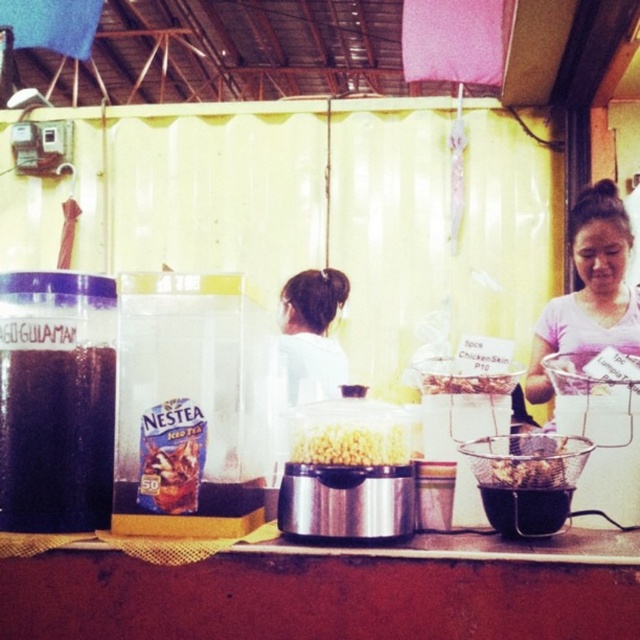
Can you confirm if yellow matte popcorn at center is shorter than brown crispy chicken skin at center?

Incorrect, yellow matte popcorn at center's height does not fall short of brown crispy chicken skin at center's.

Does point (385, 444) come in front of point (518, 458)?

No, it is behind (518, 458).

Locate an element on the screen. yellow matte popcorn at center is located at coordinates (353, 442).

Locate an element on the screen. white fabric hair at center is located at coordinates (312, 332).

Is white fabric hair at center bigger than brown crispy chicken skin at center?

Yes, white fabric hair at center is bigger than brown crispy chicken skin at center.

The height and width of the screenshot is (640, 640). Find the location of `white fabric hair at center`. white fabric hair at center is located at coordinates (312, 332).

Which is behind, point (570, 300) or point (472, 381)?

Positioned behind is point (570, 300).

From the picture: Who is more forward, (588,284) or (476,385)?

Positioned in front is point (476,385).

You are a GUI agent. You are given a task and a screenshot of the screen. Output one action in this format:
    pyautogui.click(x=<x>, y=<y>)
    Task: Click on the pink fabric at upper right
    
    Given the screenshot: What is the action you would take?
    pyautogui.click(x=589, y=289)